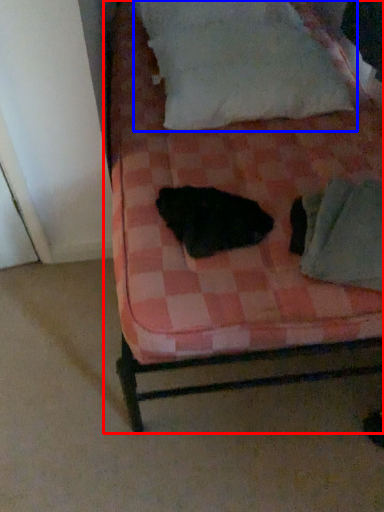
Question: Which point is closer to the camera, bed (highlighted by a red box) or pillow (highlighted by a blue box)?

Choices:
 (A) bed
 (B) pillow

Answer: (A)